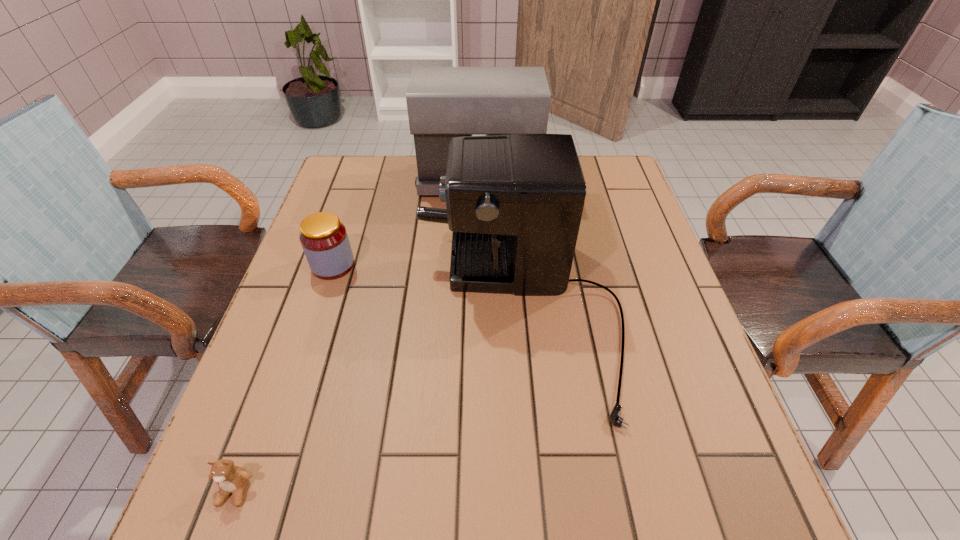
Where is `object that is at the far edge`? The width and height of the screenshot is (960, 540). object that is at the far edge is located at coordinates (442, 102).

Where is `object situated at the near edge`? The height and width of the screenshot is (540, 960). object situated at the near edge is located at coordinates (231, 479).

In order to click on jar that is at the left edge in this screenshot , I will do `click(324, 239)`.

This screenshot has width=960, height=540. In order to click on teddy bear at the left edge in this screenshot , I will do `click(231, 479)`.

This screenshot has height=540, width=960. Identify the location of object positioned at the right edge. 514,202.

Find the location of `object located at the near left corner`. object located at the near left corner is located at coordinates (231, 479).

Locate an element on the screen. The image size is (960, 540). free spot at the left edge of the desktop is located at coordinates (338, 301).

Image resolution: width=960 pixels, height=540 pixels. Identify the location of free region at the right edge of the desktop. (734, 472).

You are a GUI agent. You are given a task and a screenshot of the screen. Output one action in this format:
    pyautogui.click(x=<x>, y=<y>)
    Task: Click on the free space at the far left corner
    This screenshot has height=540, width=960.
    Given the screenshot: What is the action you would take?
    pyautogui.click(x=384, y=180)

This screenshot has height=540, width=960. Identify the location of free space at the near left corner of the desktop. (273, 512).